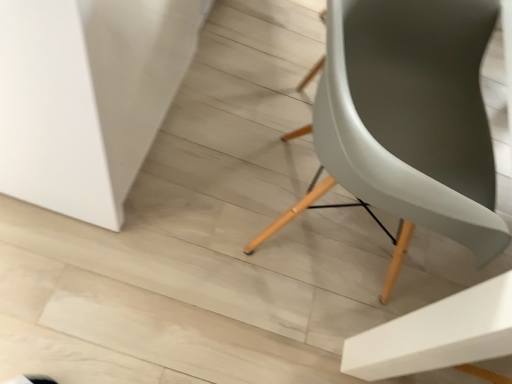
Question: From their relative heights in the image, would you say white matte table at lower left is taller or shorter than matte gray chair at center?

Choices:
 (A) tall
 (B) short

Answer: (B)

Question: Looking at the image, does white matte table at lower left seem bigger or smaller compared to matte gray chair at center?

Choices:
 (A) big
 (B) small

Answer: (A)

Question: Is white matte table at lower left wider or thinner than matte gray chair at center?

Choices:
 (A) thin
 (B) wide

Answer: (B)

Question: From the image's perspective, is matte gray chair at center located above or below white matte table at lower left?

Choices:
 (A) below
 (B) above

Answer: (A)

Question: Does point (415, 69) appear closer or farther from the camera than point (145, 142)?

Choices:
 (A) farther
 (B) closer

Answer: (B)

Question: In the image, is matte gray chair at center on the left side or the right side of white matte table at lower left?

Choices:
 (A) right
 (B) left

Answer: (A)

Question: Considering the positions of matte gray chair at center and white matte table at lower left in the image, is matte gray chair at center wider or thinner than white matte table at lower left?

Choices:
 (A) wide
 (B) thin

Answer: (B)